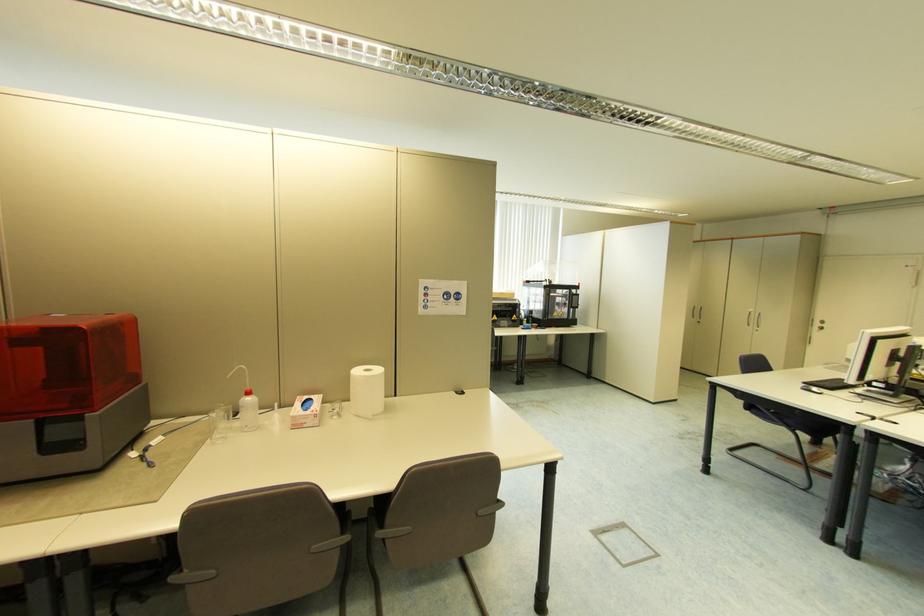
This screenshot has height=616, width=924. What are the coordinates of `door lock` in the screenshot? It's located at (821, 325).